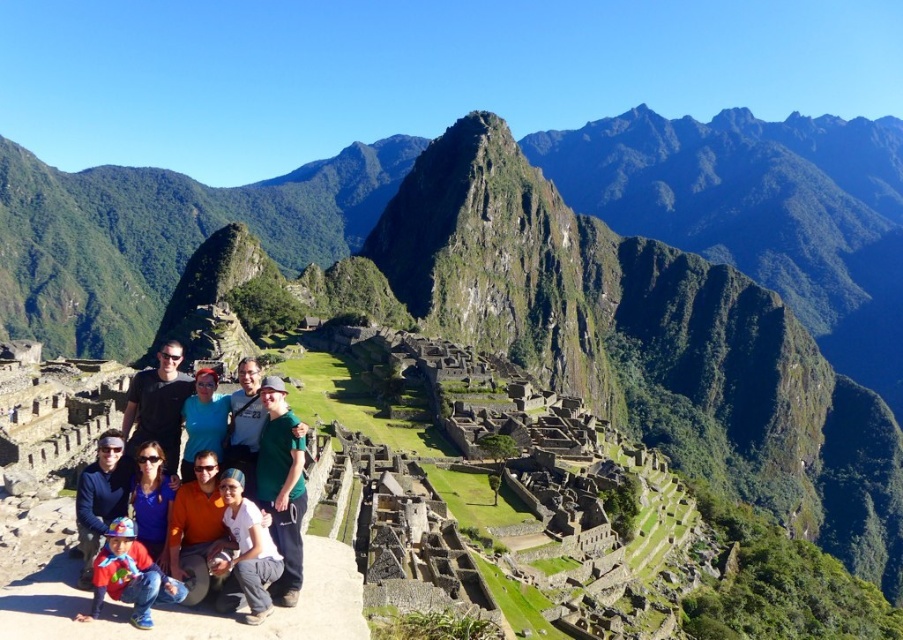
Question: Is green matte shirt at center to the right of matte red shirt at lower left from the viewer's perspective?

Choices:
 (A) no
 (B) yes

Answer: (B)

Question: Which object is the closest to the blue cotton shirt at lower left?

Choices:
 (A) multicolored clothing at center
 (B) green matte shirt at center
 (C) matte blue shirt at center

Answer: (C)

Question: Does matte red shirt at lower left have a greater width compared to blue cotton shirt at lower left?

Choices:
 (A) yes
 (B) no

Answer: (B)

Question: Among these points, which one is farthest from the camera?

Choices:
 (A) (116, 579)
 (B) (267, 392)
 (C) (80, 579)
 (D) (215, 420)

Answer: (D)

Question: Can you confirm if matte red shirt at lower left is positioned to the left of matte blue shirt at center?

Choices:
 (A) no
 (B) yes

Answer: (A)

Question: Which is farther from the multicolored clothing at center?

Choices:
 (A) matte red shirt at lower left
 (B) green matte shirt at center
 (C) matte blue shirt at center
 (D) white cotton shirt at lower center

Answer: (B)